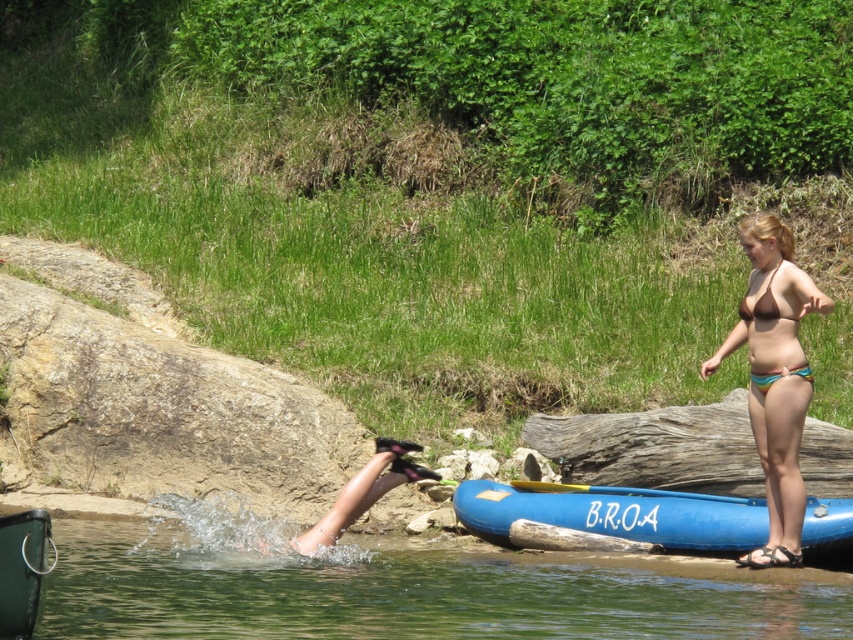
Question: Which point is closer to the camera?

Choices:
 (A) yellow wood paddle at lower center
 (B) gray rough log at center
 (C) clear water at lower left
 (D) brown bikini at right

Answer: (C)

Question: Estimate the real-world distances between objects in this image. Which object is closer to the yellow wood paddle at lower center?

Choices:
 (A) gray rough log at center
 (B) brown matte bikini top at upper right
 (C) clear water at lower left

Answer: (A)

Question: Which object appears farthest from the camera in this image?

Choices:
 (A) blue rubber canoe at lower right
 (B) brown matte bikini top at upper right

Answer: (A)

Question: Does gray rough log at center have a larger size compared to brown matte bikini top at upper right?

Choices:
 (A) no
 (B) yes

Answer: (A)

Question: Is brown bikini at right smaller than yellow wood paddle at lower center?

Choices:
 (A) no
 (B) yes

Answer: (B)

Question: From the image, what is the correct spatial relationship of gray rough log at center in relation to yellow wood paddle at lower center?

Choices:
 (A) left
 (B) right

Answer: (B)